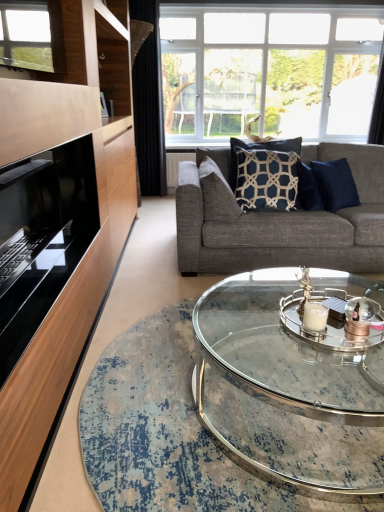
Question: Can you confirm if clear glass candle holder at center is wider than black glass fireplace at left?

Choices:
 (A) no
 (B) yes

Answer: (A)

Question: Does clear glass candle holder at center have a larger size compared to black glass fireplace at left?

Choices:
 (A) yes
 (B) no

Answer: (B)

Question: Is clear glass candle holder at center to the left of black glass fireplace at left from the viewer's perspective?

Choices:
 (A) no
 (B) yes

Answer: (A)

Question: Can you confirm if clear glass candle holder at center is shorter than black glass fireplace at left?

Choices:
 (A) yes
 (B) no

Answer: (A)

Question: Does clear glass candle holder at center contain black glass fireplace at left?

Choices:
 (A) yes
 (B) no

Answer: (B)

Question: Based on their positions, is black fabric curtain at left, which ranks as the second curtain in right-to-left order, located to the left or right of navy blue fabric pillow at center, the 2th pillow in the left-to-right sequence?

Choices:
 (A) right
 (B) left

Answer: (B)

Question: In terms of width, does black fabric curtain at left, which ranks as the second curtain in right-to-left order, look wider or thinner when compared to navy blue fabric pillow at center, the first pillow viewed from the right?

Choices:
 (A) wide
 (B) thin

Answer: (A)

Question: Is black fabric curtain at left, which ranks as the first curtain in left-to-right order, bigger or smaller than navy blue fabric pillow at center, the 2th pillow in the left-to-right sequence?

Choices:
 (A) small
 (B) big

Answer: (B)

Question: From a real-world perspective, is black fabric curtain at left, which ranks as the second curtain in right-to-left order, positioned above or below navy blue fabric pillow at center, the 2th pillow in the left-to-right sequence?

Choices:
 (A) above
 (B) below

Answer: (A)

Question: In terms of width, does black fabric curtain at left, which ranks as the second curtain in right-to-left order, look wider or thinner when compared to clear glass coffee table at center?

Choices:
 (A) thin
 (B) wide

Answer: (A)

Question: Is black fabric curtain at left, which ranks as the first curtain in left-to-right order, in front of or behind clear glass coffee table at center in the image?

Choices:
 (A) behind
 (B) front

Answer: (A)

Question: Choose the correct answer: Is black fabric curtain at left, which ranks as the second curtain in right-to-left order, inside clear glass coffee table at center or outside it?

Choices:
 (A) outside
 (B) inside

Answer: (A)

Question: From their relative heights in the image, would you say black fabric curtain at left, which ranks as the second curtain in right-to-left order, is taller or shorter than clear glass coffee table at center?

Choices:
 (A) tall
 (B) short

Answer: (A)

Question: From the image's perspective, is clear glass coffee table at center above or below black fabric curtain at left, which ranks as the second curtain in right-to-left order?

Choices:
 (A) below
 (B) above

Answer: (A)

Question: From a real-world perspective, relative to black fabric curtain at left, which ranks as the first curtain in left-to-right order, is clear glass coffee table at center vertically above or below?

Choices:
 (A) above
 (B) below

Answer: (B)